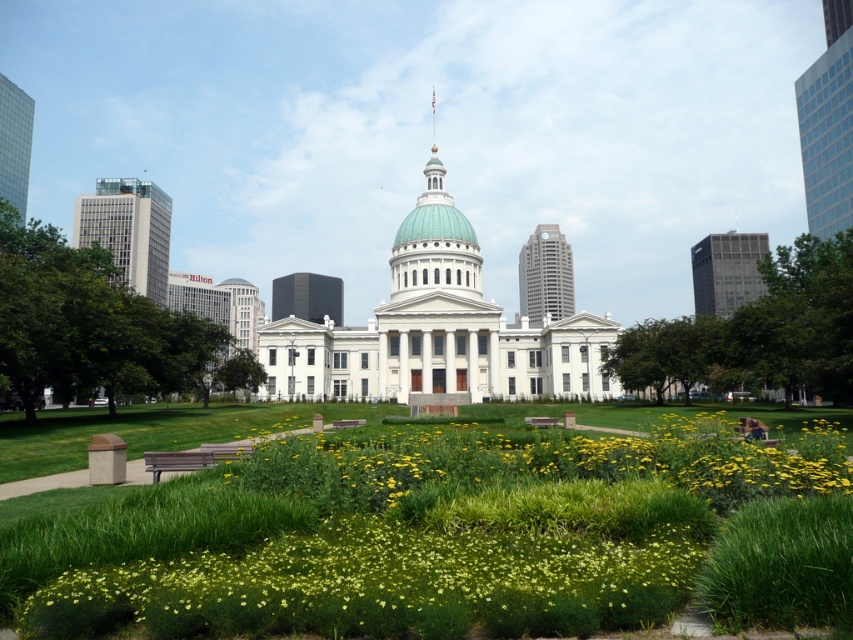
You are a visitor in the park area in front of the neoclassical building. You see a wooden park bench at lower left and a brown wooden park bench at center. Which bench is positioned to the left of the other?

The wooden park bench at lower left is positioned to the left of the brown wooden park bench at center.

In the scene shown: You are planning to host a small gathering in the park. You need to choose between the wooden park bench at lower left and the brown wooden park bench at center for seating. Which bench can accommodate more people?

The wooden park bench at lower left might be wider than brown wooden park bench at center, so it can accommodate more people.

You are standing at the center of the park and want to find the wooden park bench at lower left. Based on the coordinates provided, in which direction should you walk to reach it?

The wooden park bench at lower left is located at coordinates point (194, 458). Since you are at the center, you should walk towards the lower left direction to reach it.